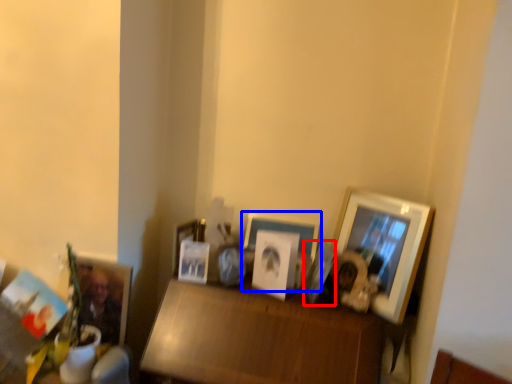
Question: Which point is closer to the camera, picture frame (highlighted by a red box) or picture frame (highlighted by a blue box)?

Choices:
 (A) picture frame
 (B) picture frame

Answer: (A)